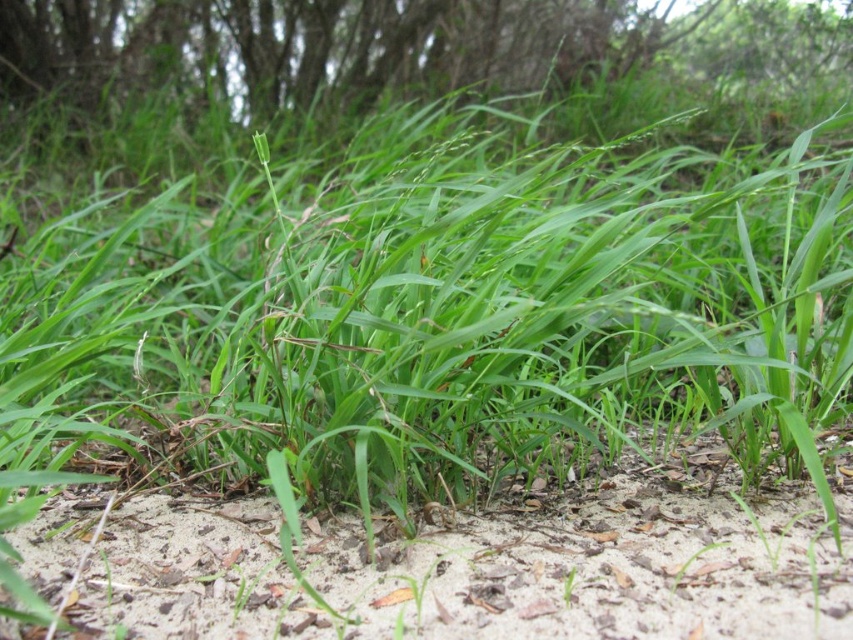
Which of these two, light brown sandy soil at center or green grass at upper center, stands shorter?

light brown sandy soil at center

From the picture: Who is more forward, (810, 502) or (569, 51)?

Point (810, 502) is in front.

Which is in front, point (112, 636) or point (271, 102)?

Point (112, 636)

You are a GUI agent. You are given a task and a screenshot of the screen. Output one action in this format:
    pyautogui.click(x=<x>, y=<y>)
    Task: Click on the light brown sandy soil at center
    The image size is (853, 640).
    Given the screenshot: What is the action you would take?
    pyautogui.click(x=596, y=570)